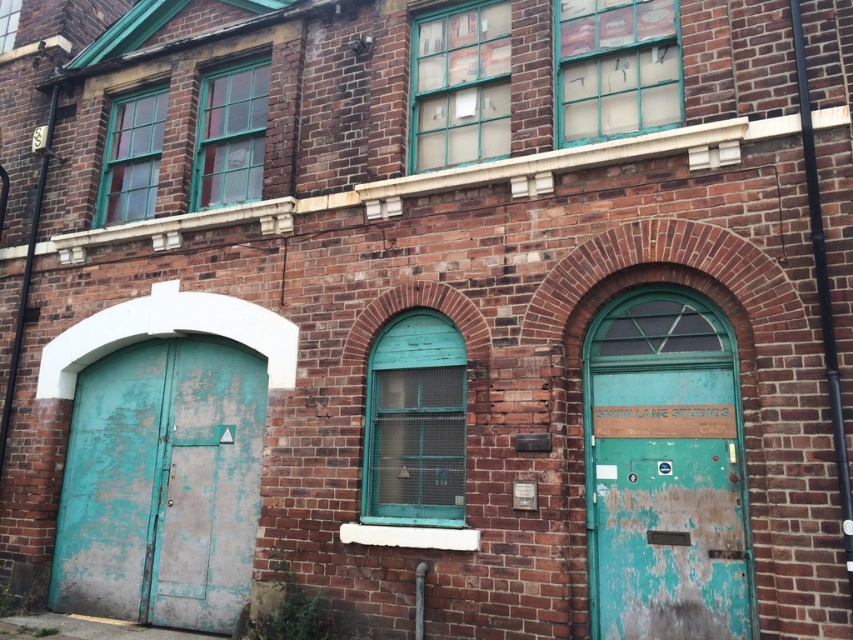
Question: Does peeling teal metal door at left have a greater width compared to peeling teal paint door at center right?

Choices:
 (A) no
 (B) yes

Answer: (B)

Question: Which point is closer to the camera?

Choices:
 (A) (607, 476)
 (B) (190, 611)

Answer: (A)

Question: Which point is farther to the camera?

Choices:
 (A) (128, 506)
 (B) (686, 595)

Answer: (A)

Question: Is peeling teal metal door at left positioned in front of peeling teal paint door at center right?

Choices:
 (A) yes
 (B) no

Answer: (B)

Question: Which point appears farthest from the camera in this image?

Choices:
 (A) (704, 506)
 (B) (119, 554)

Answer: (B)

Question: Is peeling teal metal door at left behind peeling teal paint door at center right?

Choices:
 (A) yes
 (B) no

Answer: (A)